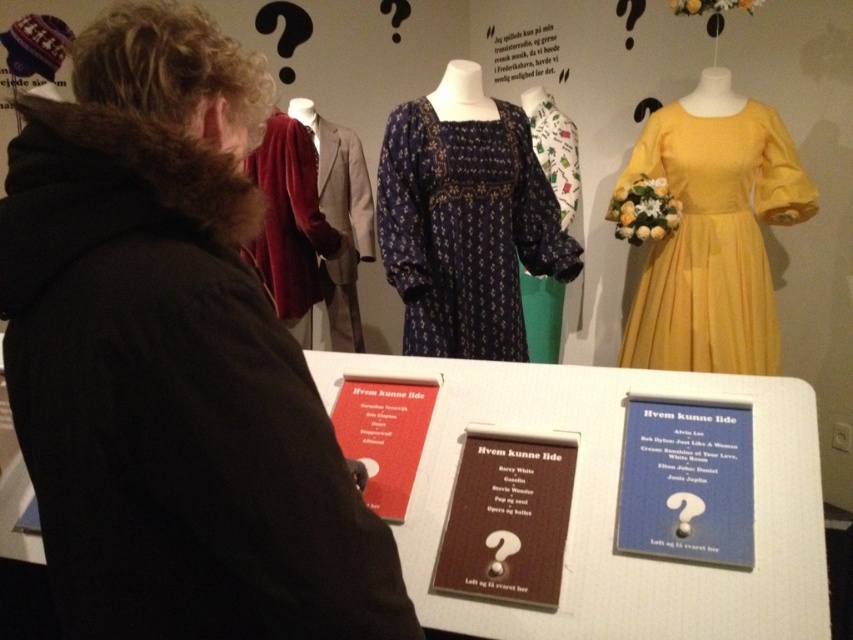
Between velvety red dress at upper left and yellow satin dress at upper right, which one has more height?

yellow satin dress at upper right

Is velvety red dress at upper left closer to the viewer compared to yellow satin dress at upper right?

Yes.

What do you see at coordinates (171, 403) in the screenshot? I see `velvety red dress at upper left` at bounding box center [171, 403].

Find the location of a particular element. The width and height of the screenshot is (853, 640). velvety red dress at upper left is located at coordinates (171, 403).

Is point (494, 148) behind point (393, 384)?

Yes.

Is navy blue printed dress at center to the right of matte red book at center from the viewer's perspective?

Yes, navy blue printed dress at center is to the right of matte red book at center.

Who is more forward, (410, 328) or (396, 404)?

Point (396, 404) is more forward.

Where is `navy blue printed dress at center`? The width and height of the screenshot is (853, 640). navy blue printed dress at center is located at coordinates (465, 228).

Can you confirm if yellow satin dress at upper right is thinner than matte brown card at center?

No.

Locate an element on the screen. yellow satin dress at upper right is located at coordinates (712, 236).